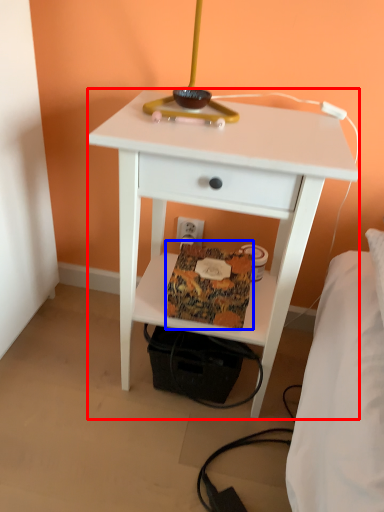
Question: Which point is closer to the camera, nightstand (highlighted by a red box) or package (highlighted by a blue box)?

Choices:
 (A) nightstand
 (B) package

Answer: (A)